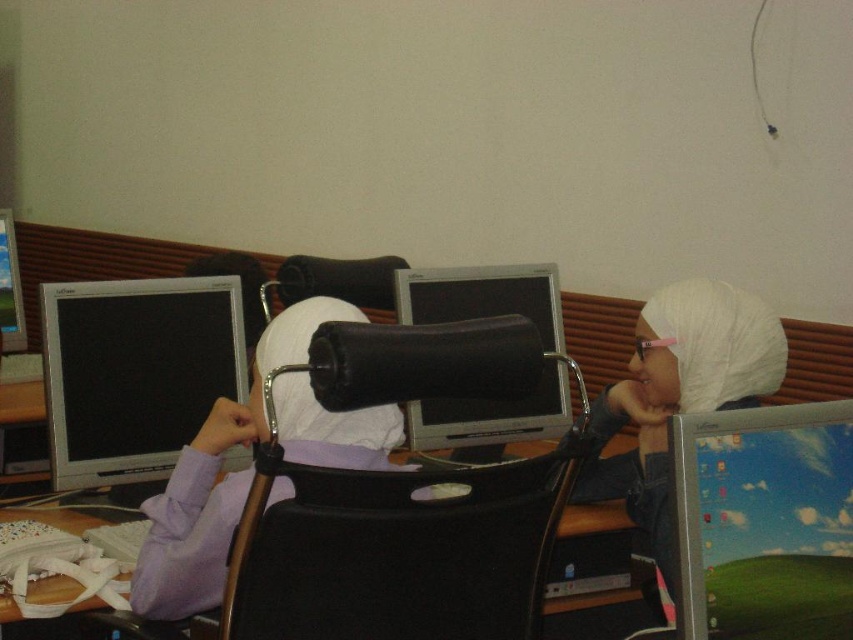
Does silver glossy monitor at lower right appear on the left side of matte black monitor at left?

Incorrect, silver glossy monitor at lower right is not on the left side of matte black monitor at left.

Between silver glossy monitor at lower right and matte black monitor at left, which one appears on the right side from the viewer's perspective?

silver glossy monitor at lower right is more to the right.

Identify the location of silver glossy monitor at lower right. (764, 522).

In the scene shown: Is matte black monitor at left shorter than white matte hijab at center?

Indeed, matte black monitor at left has a lesser height compared to white matte hijab at center.

Between point (125, 476) and point (753, 321), which one is positioned in front?

Point (753, 321) is more forward.

Locate an element on the screen. The image size is (853, 640). matte black monitor at left is located at coordinates (135, 372).

You are a GUI agent. You are given a task and a screenshot of the screen. Output one action in this format:
    pyautogui.click(x=<x>, y=<y>)
    Task: Click on the matte black monitor at left
    
    Given the screenshot: What is the action you would take?
    pyautogui.click(x=135, y=372)

Is purple fabric headscarf at center positioned before matte black monitor at center?

Yes, purple fabric headscarf at center is in front of matte black monitor at center.

Does purple fabric headscarf at center appear under matte black monitor at center?

Yes, purple fabric headscarf at center is below matte black monitor at center.

Where is `purple fabric headscarf at center`? purple fabric headscarf at center is located at coordinates (215, 477).